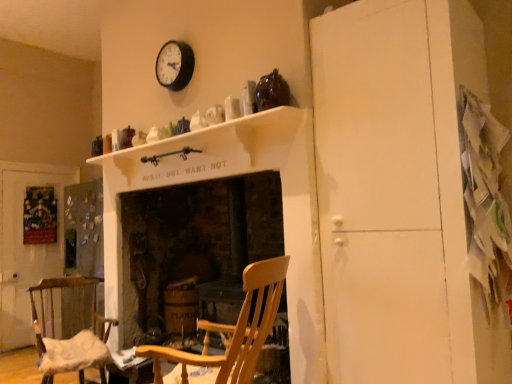
Question: From the image's perspective, would you say white paper at lower left is positioned over wooden fireplace at center?

Choices:
 (A) yes
 (B) no

Answer: (B)

Question: From a real-world perspective, is white paper at lower left on wooden fireplace at center?

Choices:
 (A) no
 (B) yes

Answer: (A)

Question: From a real-world perspective, is white paper at lower left under wooden fireplace at center?

Choices:
 (A) no
 (B) yes

Answer: (B)

Question: Is white paper at lower left oriented away from wooden fireplace at center?

Choices:
 (A) yes
 (B) no

Answer: (B)

Question: Is white paper at lower left not close to wooden fireplace at center?

Choices:
 (A) yes
 (B) no

Answer: (A)

Question: In terms of height, does matte black clock at upper center look taller or shorter compared to wooden chair with fabric cushion at lower left, the 2th chair from the right?

Choices:
 (A) tall
 (B) short

Answer: (B)

Question: Looking at their shapes, would you say matte black clock at upper center is wider or thinner than wooden chair with fabric cushion at lower left, the 2th chair from the right?

Choices:
 (A) thin
 (B) wide

Answer: (A)

Question: From a real-world perspective, is matte black clock at upper center positioned above or below wooden chair with fabric cushion at lower left, marked as the second chair in a front-to-back arrangement?

Choices:
 (A) below
 (B) above

Answer: (B)

Question: Considering their positions, is matte black clock at upper center located in front of or behind wooden chair with fabric cushion at lower left, marked as the first chair in a back-to-front arrangement?

Choices:
 (A) behind
 (B) front

Answer: (A)

Question: Is white matte mantle at upper center inside the boundaries of wooden fireplace at center, or outside?

Choices:
 (A) outside
 (B) inside

Answer: (A)

Question: In the image, is white matte mantle at upper center on the left side or the right side of wooden fireplace at center?

Choices:
 (A) right
 (B) left

Answer: (B)

Question: Considering their positions, is white matte mantle at upper center located in front of or behind wooden fireplace at center?

Choices:
 (A) front
 (B) behind

Answer: (A)

Question: From a real-world perspective, is white matte mantle at upper center above or below wooden fireplace at center?

Choices:
 (A) above
 (B) below

Answer: (A)

Question: Considering the positions of white matte mantle at upper center and white matte cabinet at right in the image, is white matte mantle at upper center taller or shorter than white matte cabinet at right?

Choices:
 (A) short
 (B) tall

Answer: (A)

Question: Is white matte mantle at upper center to the left or to the right of white matte cabinet at right in the image?

Choices:
 (A) right
 (B) left

Answer: (B)